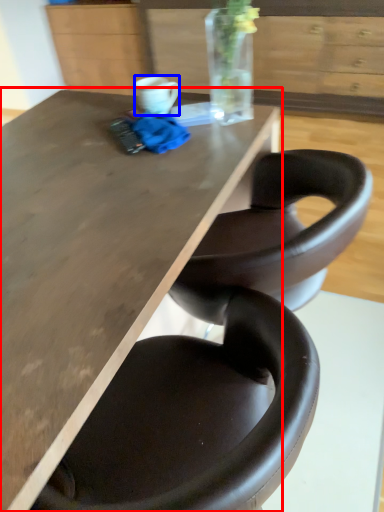
Question: Which of the following is the farthest to the observer, table (highlighted by a red box) or mug (highlighted by a blue box)?

Choices:
 (A) table
 (B) mug

Answer: (B)